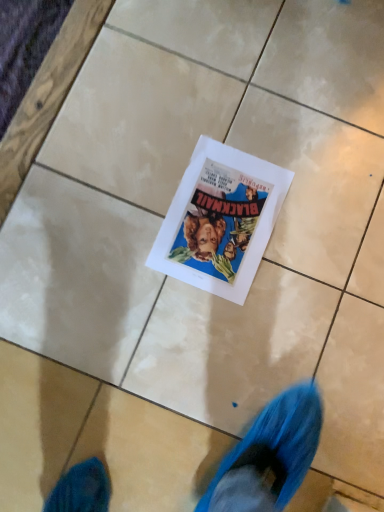
You are a GUI agent. You are given a task and a screenshot of the screen. Output one action in this format:
    pyautogui.click(x=<x>, y=<y>)
    Task: Click on the vacant space situated above matte paper poster at center (from a real-world perspective)
    
    Given the screenshot: What is the action you would take?
    pyautogui.click(x=224, y=219)